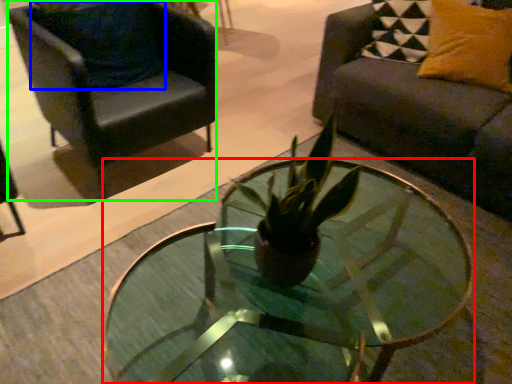
Question: Based on their relative distances, which object is nearer to coffee table (highlighted by a red box)? Choose from pillow (highlighted by a blue box) and chair (highlighted by a green box).

Choices:
 (A) pillow
 (B) chair

Answer: (B)